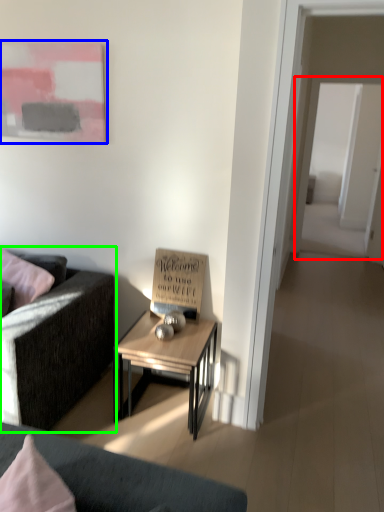
Question: Considering the real-world distances, which object is closest to glass door (highlighted by a red box)? picture frame (highlighted by a blue box) or studio couch (highlighted by a green box).

Choices:
 (A) picture frame
 (B) studio couch

Answer: (A)